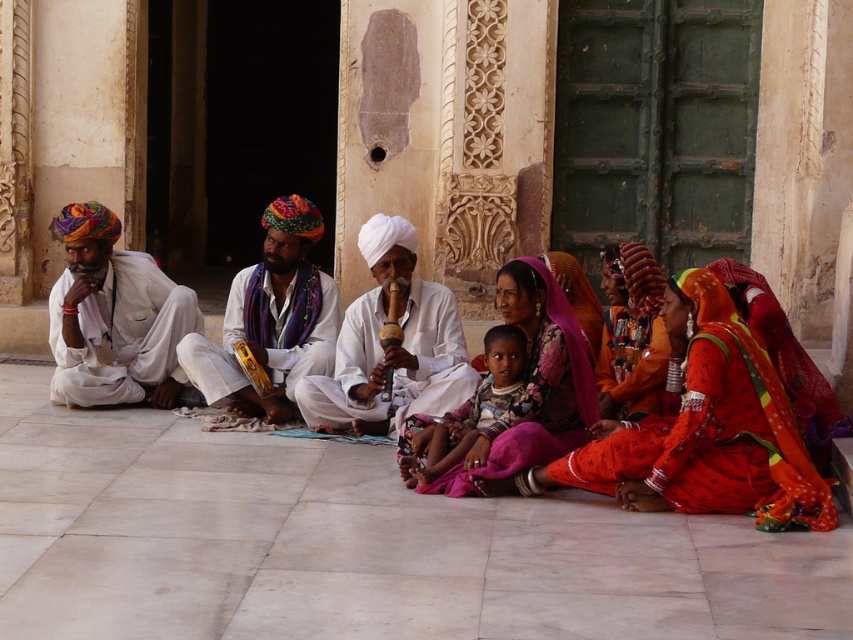
Question: Can you confirm if matte white clothing at center is positioned below pink satin saree at center?

Choices:
 (A) no
 (B) yes

Answer: (B)

Question: Among these objects, which one is nearest to the camera?

Choices:
 (A) matte white turban at center
 (B) shiny orange fabric at center
 (C) shiny red fabric at center
 (D) white matte turban at center

Answer: (C)

Question: Does shiny orange fabric at center come in front of floral fabric child at center?

Choices:
 (A) yes
 (B) no

Answer: (B)

Question: Which of the following is the farthest from the observer?

Choices:
 (A) (596, 371)
 (B) (451, 488)

Answer: (A)

Question: Which point is closer to the camera taking this photo?

Choices:
 (A) (619, 451)
 (B) (125, 378)
 (C) (373, 237)

Answer: (A)

Question: Is matte white turban at center positioned behind shiny orange fabric at center?

Choices:
 (A) no
 (B) yes

Answer: (B)